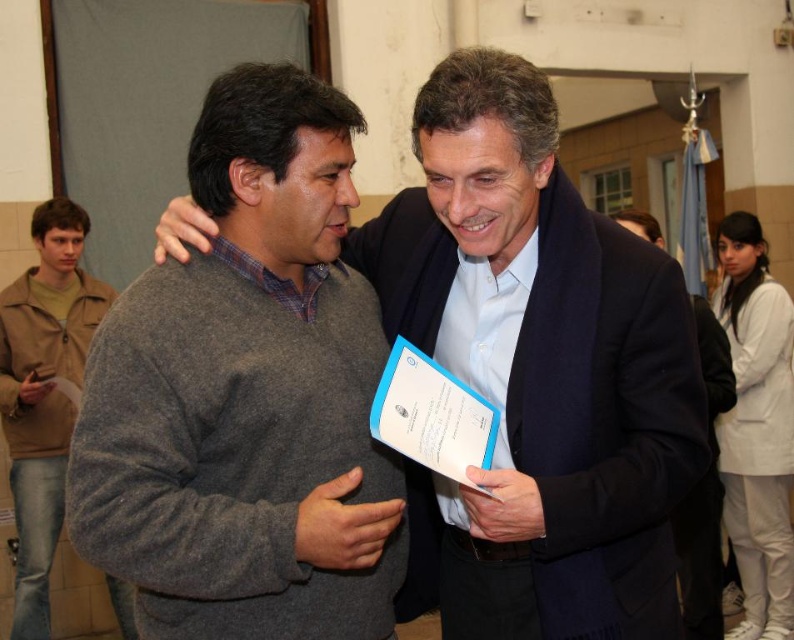
What object is located at the coordinate point (247,394) in the image?

The point (247,394) is on the gray wool sweater at left.

Consider the image. You are a photographer standing in front of the two people in the scene. You want to take a photo that captures both the gray wool sweater at left and the brown leather jacket at left clearly. However, your camera can only focus on one object at a time. Which object should you focus on to ensure both are in focus?

A: You should focus on the gray wool sweater at left because it is closer to the viewer than the brown leather jacket at left. By focusing on the closer object, the depth of field may extend to include the farther object in acceptable focus.

You are a photographer standing 10 feet away from the two people in the image. You want to take a photo of the gray wool sweater at center without the gray wool sweater at left being in the frame. Is this possible given their current positions?

The gray wool sweater at left is 14.35 inches away from the gray wool sweater at center. Since the photographer is 10 feet away, which is significantly farther than the 14.35 inches between them, it is possible to frame the photo to exclude the gray wool sweater at left while capturing the gray wool sweater at center.